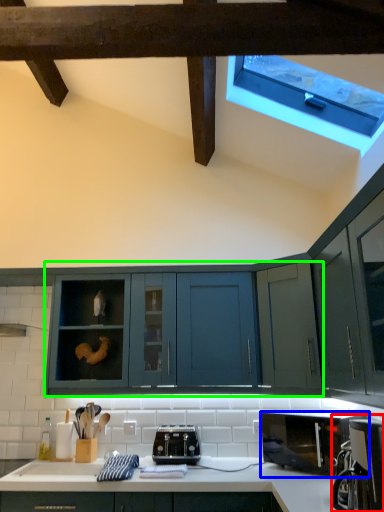
Question: Which is farther away from coffee machine (highlighted by a red box)? microwave oven (highlighted by a blue box) or cabinetry (highlighted by a green box)?

Choices:
 (A) microwave oven
 (B) cabinetry

Answer: (B)